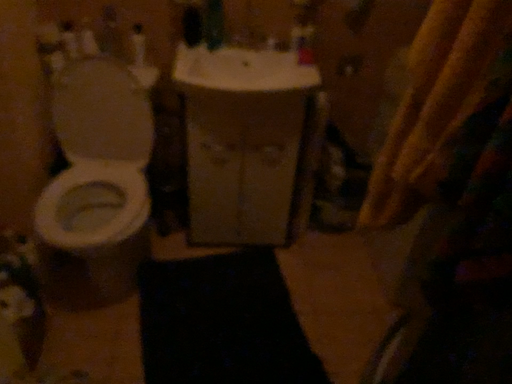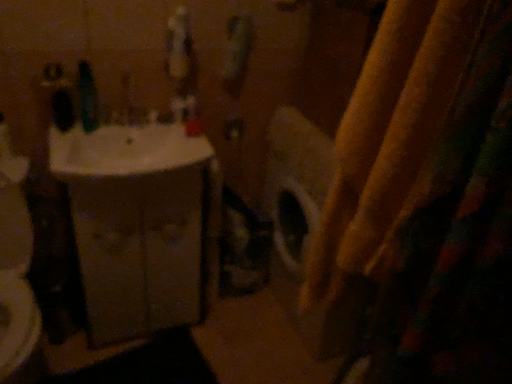
Question: Which way did the camera rotate in the video?

Choices:
 (A) rotated left
 (B) rotated right

Answer: (B)